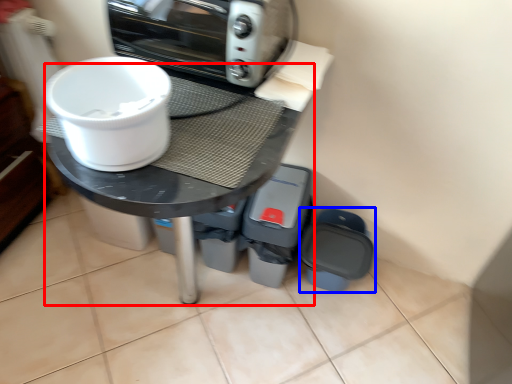
Question: Which object is further to the camera taking this photo, round table (highlighted by a red box) or appliance (highlighted by a blue box)?

Choices:
 (A) round table
 (B) appliance

Answer: (B)